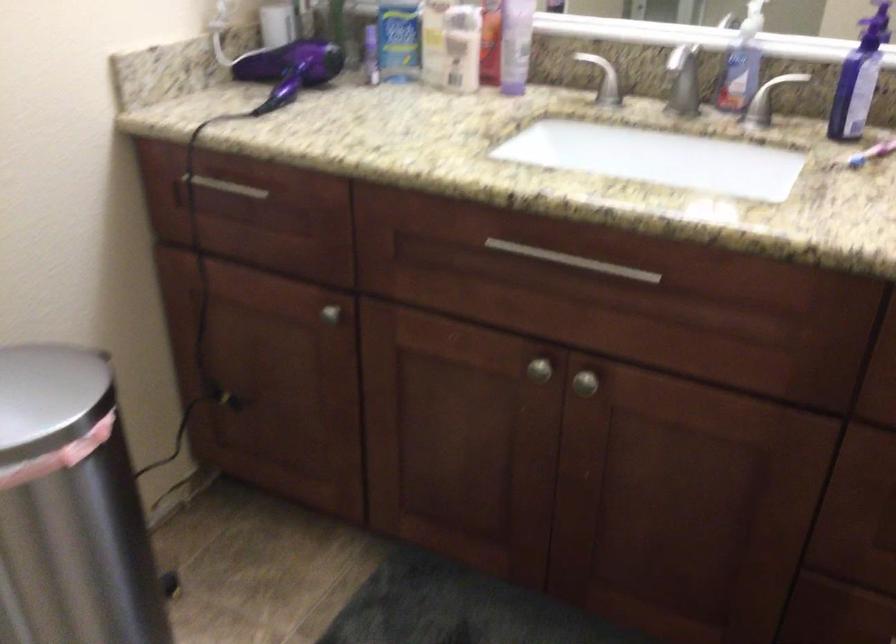
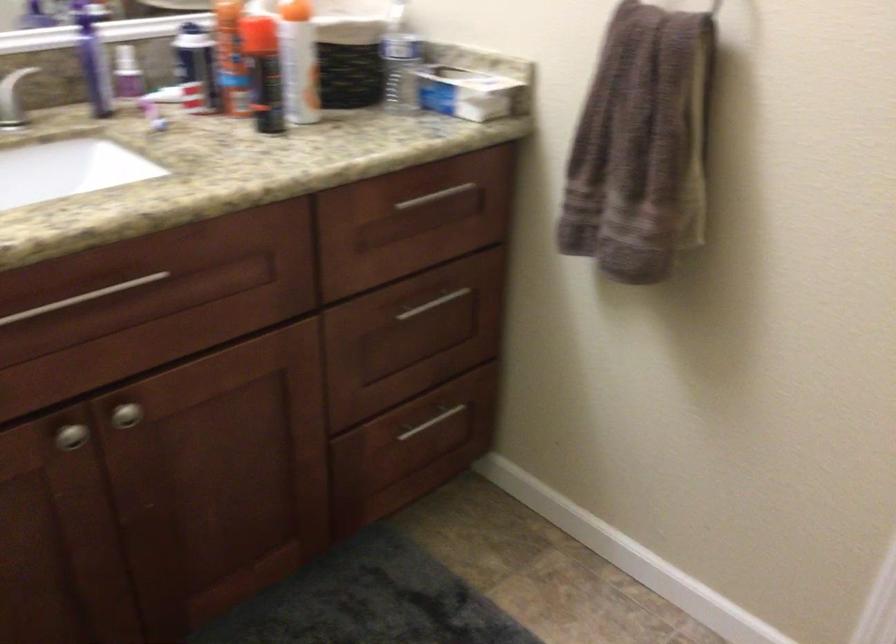
In the second image, find the point that corresponds to (582,380) in the first image.

(125, 415)